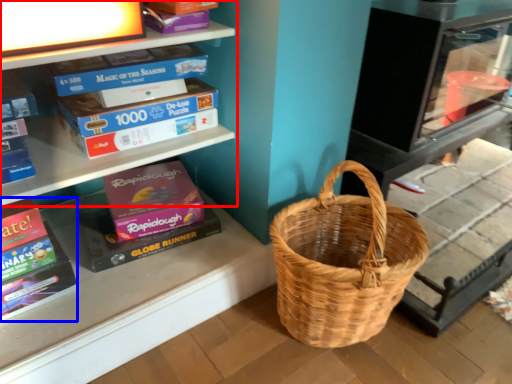
Question: Which object appears closest to the camera in this image, shelf (highlighted by a red box) or paperback book (highlighted by a blue box)?

Choices:
 (A) shelf
 (B) paperback book

Answer: (B)